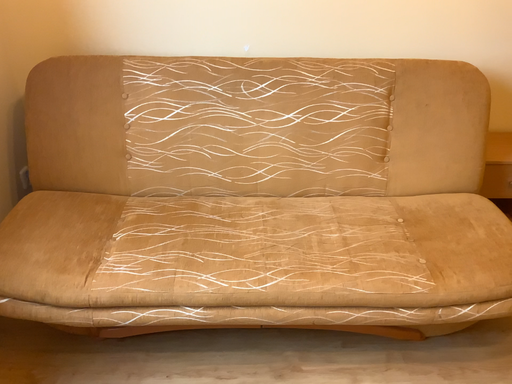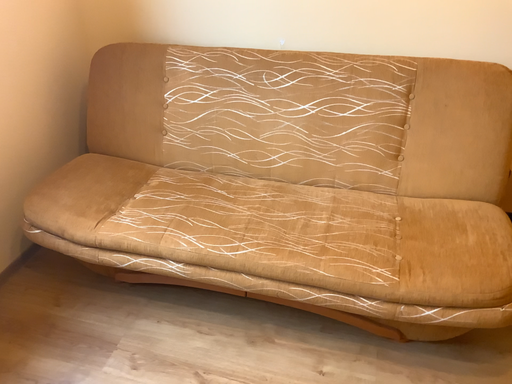
Question: How did the camera likely rotate when shooting the video?

Choices:
 (A) rotated left
 (B) rotated right

Answer: (A)